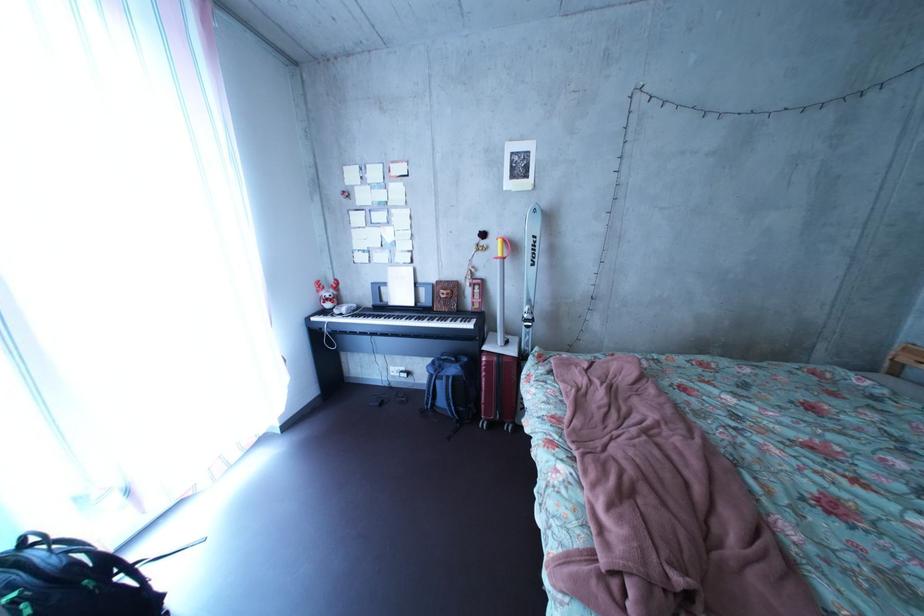
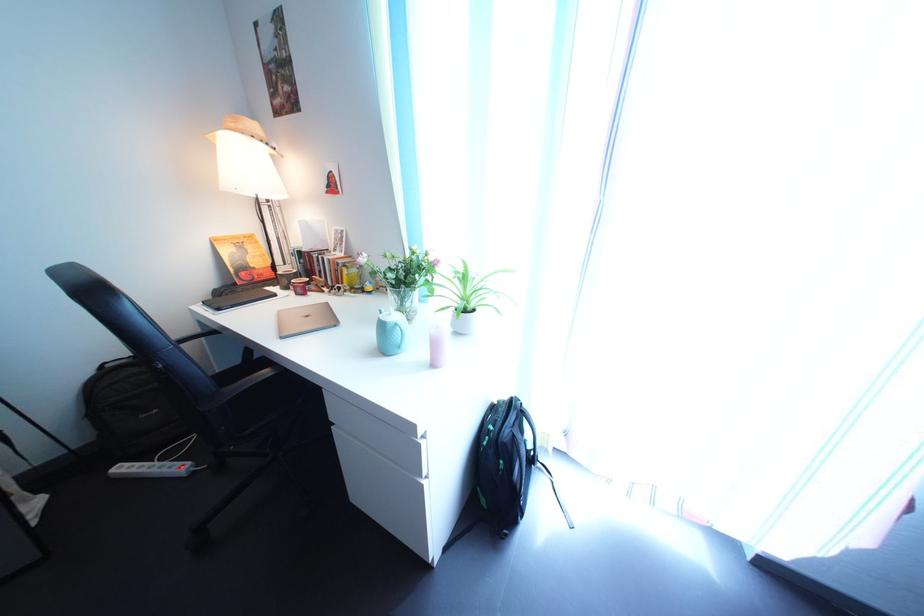
First-person continuous shooting, in which direction is the camera rotating?

The camera's rotation is toward left-down.